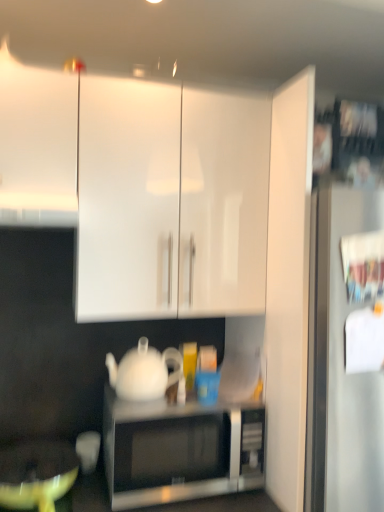
Question: Can you confirm if white glossy cabinet at upper left, which ranks as the 2th cabinetry in right-to-left order, is thinner than white glossy cabinet at upper center, the second cabinetry from the left?

Choices:
 (A) no
 (B) yes

Answer: (A)

Question: From the image's perspective, is white glossy cabinet at upper left, which ranks as the 2th cabinetry in right-to-left order, under white glossy cabinet at upper center, which appears as the 1th cabinetry when viewed from the right?

Choices:
 (A) no
 (B) yes

Answer: (A)

Question: Is white glossy cabinet at upper left, the 1th cabinetry viewed from the left, taller than white glossy cabinet at upper center, the second cabinetry from the left?

Choices:
 (A) no
 (B) yes

Answer: (A)

Question: From a real-world perspective, is white glossy cabinet at upper left, the 1th cabinetry viewed from the left, under white glossy cabinet at upper center, the second cabinetry from the left?

Choices:
 (A) yes
 (B) no

Answer: (B)

Question: Is white glossy cabinet at upper left, which ranks as the 2th cabinetry in right-to-left order, wider than white glossy cabinet at upper center, which appears as the 1th cabinetry when viewed from the right?

Choices:
 (A) no
 (B) yes

Answer: (B)

Question: Does white glossy cabinet at upper left, which ranks as the 2th cabinetry in right-to-left order, contain white glossy cabinet at upper center, the second cabinetry from the left?

Choices:
 (A) no
 (B) yes

Answer: (A)

Question: Is white glossy cabinet at upper left, which ranks as the 2th cabinetry in right-to-left order, to the left of white glossy teapot at center from the viewer's perspective?

Choices:
 (A) yes
 (B) no

Answer: (A)

Question: Does white glossy cabinet at upper left, which ranks as the 2th cabinetry in right-to-left order, have a larger size compared to white glossy teapot at center?

Choices:
 (A) yes
 (B) no

Answer: (A)

Question: Could you tell me if white glossy cabinet at upper left, which ranks as the 2th cabinetry in right-to-left order, is facing white glossy teapot at center?

Choices:
 (A) yes
 (B) no

Answer: (B)

Question: Is white glossy cabinet at upper left, which ranks as the 2th cabinetry in right-to-left order, wider than white glossy teapot at center?

Choices:
 (A) no
 (B) yes

Answer: (B)

Question: From the image's perspective, does white glossy cabinet at upper left, the 1th cabinetry viewed from the left, appear higher than white glossy teapot at center?

Choices:
 (A) no
 (B) yes

Answer: (B)

Question: From the image's perspective, is white glossy cabinet at upper left, which ranks as the 2th cabinetry in right-to-left order, under white glossy teapot at center?

Choices:
 (A) no
 (B) yes

Answer: (A)

Question: From a real-world perspective, is matte yellow mixing bowl at lower left beneath white glossy cabinet at upper center, the second cabinetry from the left?

Choices:
 (A) no
 (B) yes

Answer: (B)